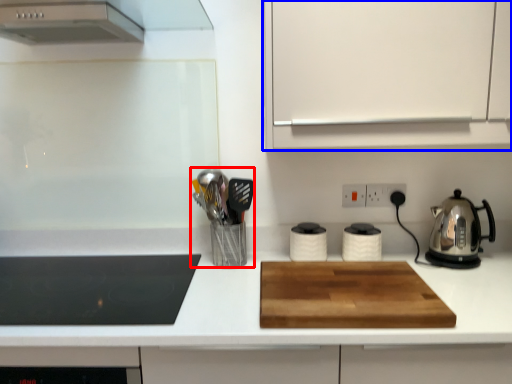
Question: Which object appears farthest to the camera in this image, appliance (highlighted by a red box) or cabinetry (highlighted by a blue box)?

Choices:
 (A) appliance
 (B) cabinetry

Answer: (A)